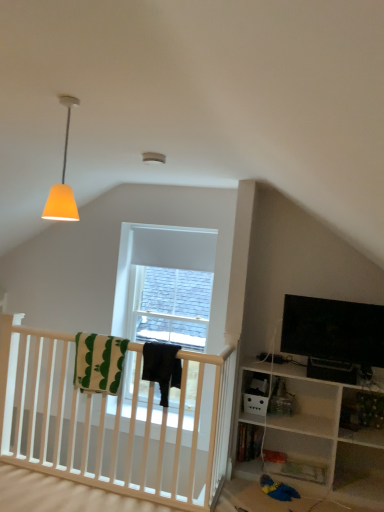
At what (x,y) coordinates should I click in order to perform the action: click on free location above orange matte lampshade at upper left (from a real-world perspective). Please return your answer as a coordinate pair (x, y). The image size is (384, 512). Looking at the image, I should click on (76, 98).